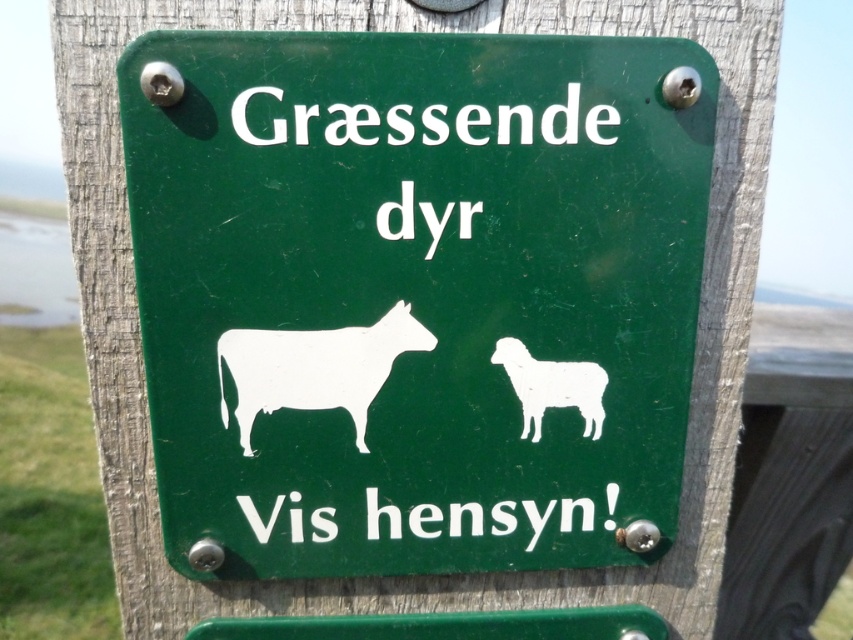
You are standing in front of the green sign with cow and sheep silhouettes. There are two points marked on the sign. Which point is closer to you, point (175, 509) or point (409, 340)?

Point (175, 509) is further to the viewer than point (409, 340), so point (409, 340) is closer to you.

You are a driver approaching a sign with two sheep images. The sign has a white paper sheep at center and a white matte sheep at center. Which sheep image is wider?

The white paper sheep at center is wider than the white matte sheep at center.